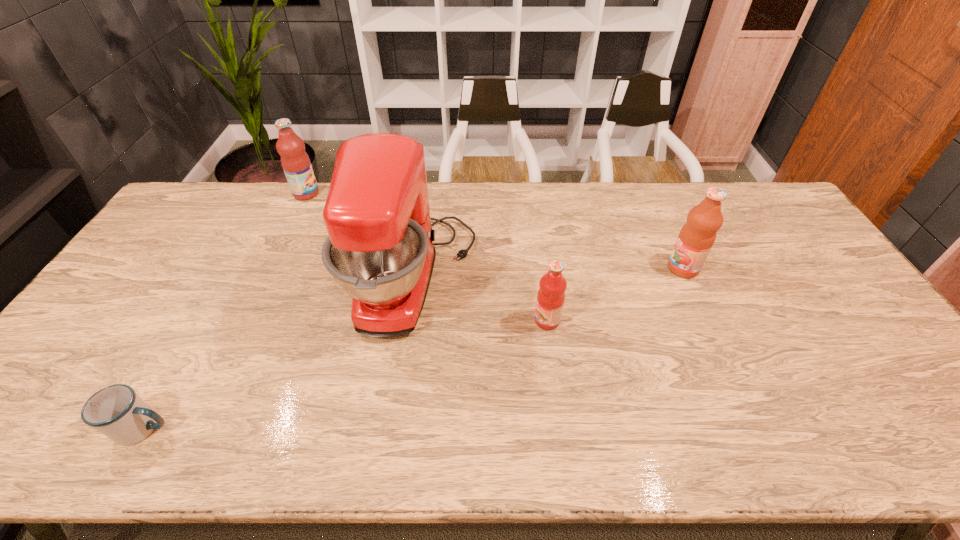
Image resolution: width=960 pixels, height=540 pixels. Identify the location of vacant region located on the front-facing side of the kitchen mixer. (516, 279).

Where is `vacant space located 0.120m on the front label of the second object from left to right`? The image size is (960, 540). vacant space located 0.120m on the front label of the second object from left to right is located at coordinates (352, 194).

The height and width of the screenshot is (540, 960). In order to click on vacant position located 0.110m on the front label of the rightmost fruit juice in this screenshot , I will do `click(632, 268)`.

I want to click on vacant space located 0.380m on the front label of the rightmost fruit juice, so click(x=542, y=268).

Image resolution: width=960 pixels, height=540 pixels. What are the coordinates of `vacant area situated on the front label of the rightmost fruit juice` in the screenshot? It's located at 549,268.

The image size is (960, 540). Identify the location of vacant region located on the front label of the nearest fruit juice. (516, 321).

Find the location of `free point located 0.190m on the front label of the nearest fruit juice`. free point located 0.190m on the front label of the nearest fruit juice is located at coordinates (465, 321).

Locate an element on the screen. free space located 0.340m on the front label of the nearest fruit juice is located at coordinates (410, 321).

Identify the location of free point located 0.400m on the handle side of the nearest object. The width and height of the screenshot is (960, 540). (352, 429).

Where is `kitchen mixer that is positioned at the far edge`? kitchen mixer that is positioned at the far edge is located at coordinates point(380,250).